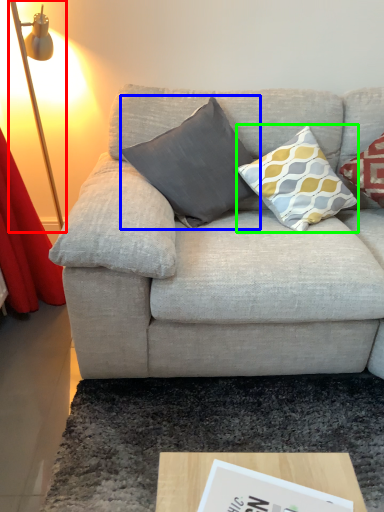
Question: Which is farther away from table lamp (highlighted by a red box)? pillow (highlighted by a blue box) or pillow (highlighted by a green box)?

Choices:
 (A) pillow
 (B) pillow

Answer: (B)